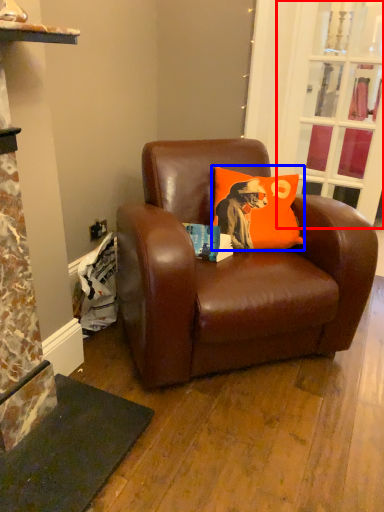
Question: Which point is further to the camera, glass door (highlighted by a red box) or pillow (highlighted by a blue box)?

Choices:
 (A) glass door
 (B) pillow

Answer: (A)